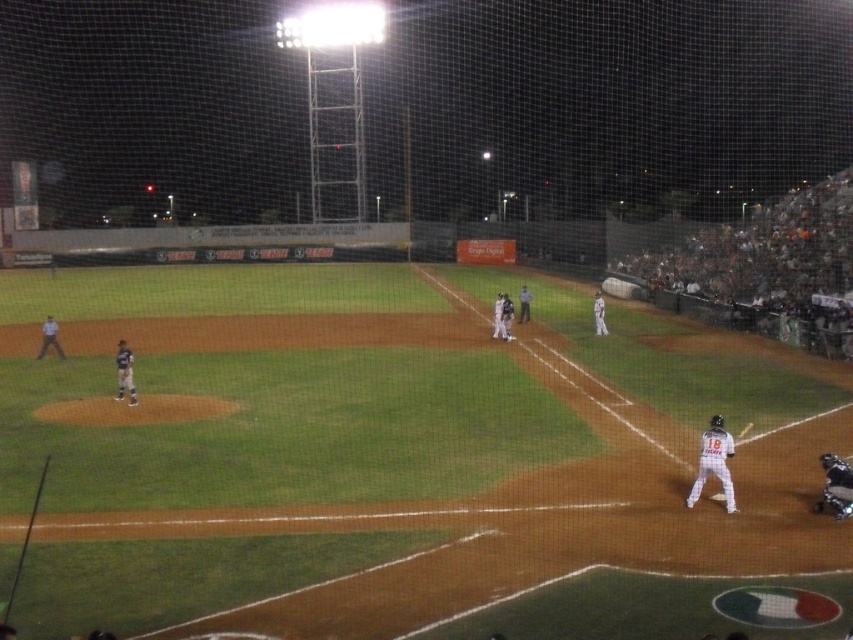
Question: Which object is farther from the camera taking this photo?

Choices:
 (A) metallic silver helmet at lower right
 (B) white matte uniform at lower right

Answer: (B)

Question: Which of the following is the farthest from the observer?

Choices:
 (A) (692, 502)
 (B) (741, 436)
 (C) (838, 492)
 (D) (728, 276)

Answer: (D)

Question: Where is white matte baseball player at upper right located in relation to yellow wood bat at lower right in the image?

Choices:
 (A) right
 (B) left

Answer: (A)

Question: Which object is the farthest from the white matte baseball player at upper right?

Choices:
 (A) yellow wood bat at lower right
 (B) white matte uniform at lower right
 (C) metallic silver helmet at lower right

Answer: (B)

Question: Where is white matte baseball player at upper right located in relation to yellow wood bat at lower right in the image?

Choices:
 (A) right
 (B) left

Answer: (A)

Question: Where is metallic silver helmet at lower right located in relation to yellow wood bat at lower right in the image?

Choices:
 (A) above
 (B) below

Answer: (B)